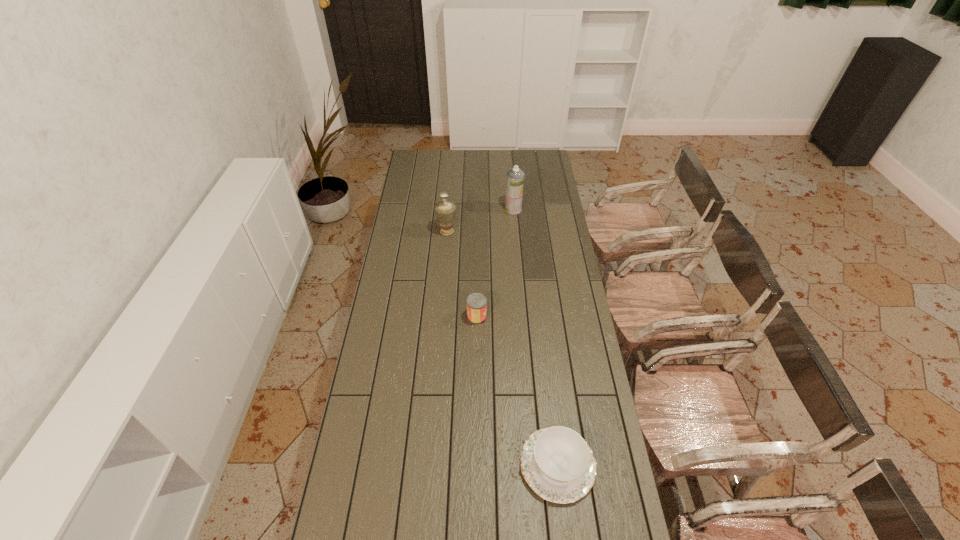
Image resolution: width=960 pixels, height=540 pixels. In order to click on the farthest object in this screenshot , I will do `click(515, 177)`.

Identify the location of urn. point(445,211).

Identify the location of the second tallest object. The image size is (960, 540). (445, 211).

You are a GUI agent. You are given a task and a screenshot of the screen. Output one action in this format:
    pyautogui.click(x=<x>, y=<y>)
    Task: Click on the second nearest object
    The height and width of the screenshot is (540, 960).
    Given the screenshot: What is the action you would take?
    476,303

This screenshot has width=960, height=540. I want to click on the second object from left to right, so click(x=476, y=303).

You are a GUI agent. You are given a task and a screenshot of the screen. Output one action in this format:
    pyautogui.click(x=<x>, y=<y>)
    Task: Click on the nearest object
    
    Given the screenshot: What is the action you would take?
    pyautogui.click(x=557, y=463)

Where is `free space located 0.110m on the front of the aerosol can`? free space located 0.110m on the front of the aerosol can is located at coordinates (515, 228).

This screenshot has height=540, width=960. I want to click on vacant space situated 0.190m on the left of the urn, so click(398, 232).

Identify the location of vacant space situated 0.090m on the back of the second nearest object. (477, 293).

Identify the location of vacant area situated 0.050m on the handle side of the nearest object. (504, 465).